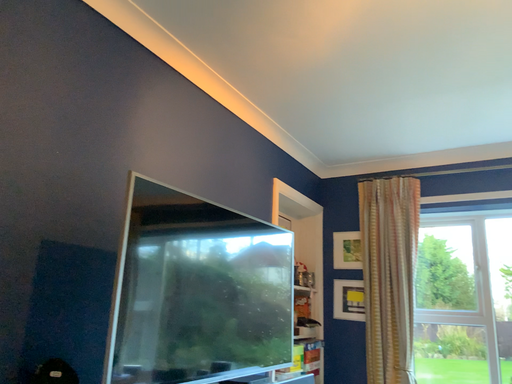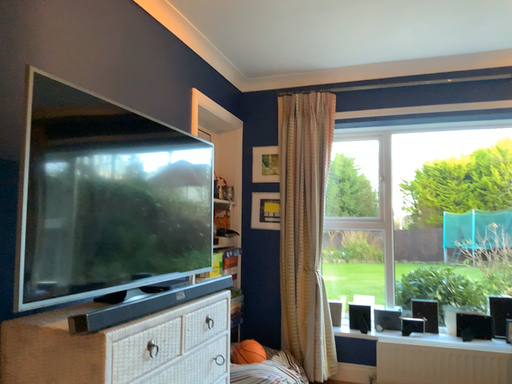
Question: Which way did the camera rotate in the video?

Choices:
 (A) rotated upward
 (B) rotated downward

Answer: (B)